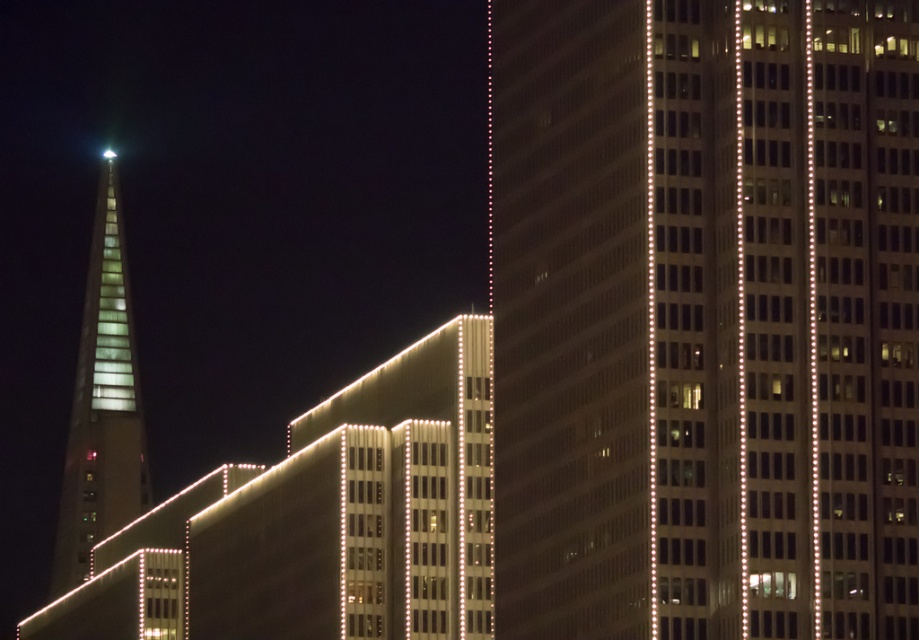
In order to click on glassy reflective skyscraper at center in this screenshot , I will do `click(705, 317)`.

Is point (800, 26) behind point (115, 152)?

No, (800, 26) is closer to viewer.

Where is `glassy reflective skyscraper at center`? glassy reflective skyscraper at center is located at coordinates (705, 317).

Between point (97, 406) and point (112, 160), which one is positioned behind?

The point (112, 160) is more distant.

Can you confirm if translucent glass tower at left is smaller than white translucent light at upper left?

Incorrect, translucent glass tower at left is not smaller in size than white translucent light at upper left.

This screenshot has width=919, height=640. I want to click on translucent glass tower at left, so click(101, 406).

Is glassy reflective skyscraper at center shorter than translucent glass tower at left?

Yes.

Is glassy reflective skyscraper at center above translucent glass tower at left?

Indeed, glassy reflective skyscraper at center is positioned over translucent glass tower at left.

Find the location of `glassy reflective skyscraper at center`. glassy reflective skyscraper at center is located at coordinates (705, 317).